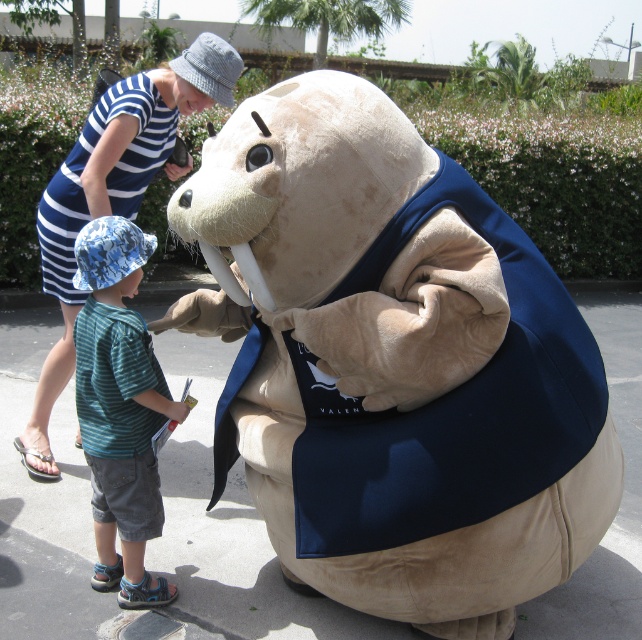
Based on the scene description, what object is located at the coordinates point (119, 406)?

The point (119, 406) corresponds to the striped cotton shirt at center.

You are a photographer trying to capture a photo of the striped cotton shirt at center and the blue striped dress at upper left. Which object should you focus on first to ensure both are in frame?

The striped cotton shirt at center should be focused on first since it is in front of the blue striped dress at upper left, ensuring both remain in the frame by starting with the foreground.

You are standing in the outdoor scene and want to place a small flag at the point closer to you between point (157, 376) and point (153, 148). Which point should you choose?

Point (157, 376) is closer to the viewer than point (153, 148), so you should choose point (157, 376) to place the small flag.